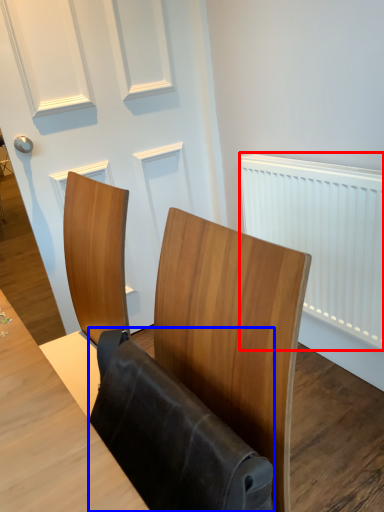
Question: Which point is closer to the camera, radiator (highlighted by a red box) or folding chair (highlighted by a blue box)?

Choices:
 (A) radiator
 (B) folding chair

Answer: (B)